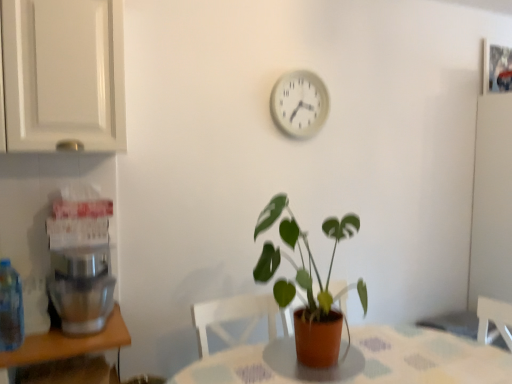
Question: Should I look upward or downward to see white plastic clock at upper center?

Choices:
 (A) down
 (B) up

Answer: (B)

Question: Is white plastic clock at upper center positioned beyond the bounds of white glossy cabinet at upper left?

Choices:
 (A) yes
 (B) no

Answer: (A)

Question: Is white plastic clock at upper center positioned with its back to white glossy cabinet at upper left?

Choices:
 (A) no
 (B) yes

Answer: (A)

Question: Is white plastic clock at upper center shorter than white glossy cabinet at upper left?

Choices:
 (A) yes
 (B) no

Answer: (A)

Question: From the image's perspective, is white plastic clock at upper center under white glossy cabinet at upper left?

Choices:
 (A) no
 (B) yes

Answer: (A)

Question: From a real-world perspective, is white plastic clock at upper center on top of white glossy cabinet at upper left?

Choices:
 (A) no
 (B) yes

Answer: (A)

Question: Is white plastic clock at upper center wider than white glossy cabinet at upper left?

Choices:
 (A) no
 (B) yes

Answer: (A)

Question: Is translucent plastic bottle at left oriented towards metallic silver coffee machine at left?

Choices:
 (A) yes
 (B) no

Answer: (B)

Question: Can you confirm if translucent plastic bottle at left is shorter than metallic silver coffee machine at left?

Choices:
 (A) yes
 (B) no

Answer: (B)

Question: From a real-world perspective, is translucent plastic bottle at left on metallic silver coffee machine at left?

Choices:
 (A) no
 (B) yes

Answer: (B)

Question: Is translucent plastic bottle at left positioned beyond the bounds of metallic silver coffee machine at left?

Choices:
 (A) yes
 (B) no

Answer: (A)

Question: Can you confirm if translucent plastic bottle at left is smaller than metallic silver coffee machine at left?

Choices:
 (A) yes
 (B) no

Answer: (A)

Question: Would you say metallic silver coffee machine at left is part of translucent plastic bottle at left's contents?

Choices:
 (A) no
 (B) yes

Answer: (A)

Question: Considering the relative sizes of white plastic clock at upper center and translucent plastic bottle at left in the image provided, is white plastic clock at upper center bigger than translucent plastic bottle at left?

Choices:
 (A) yes
 (B) no

Answer: (A)